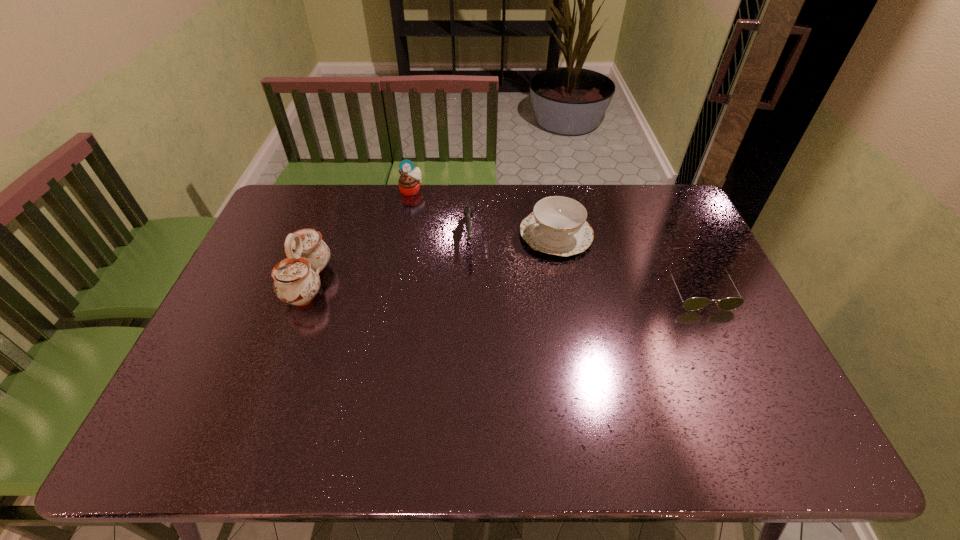
Where is `vacant area that lies between the fourth object from left to right and the third object from left to right`? Image resolution: width=960 pixels, height=540 pixels. vacant area that lies between the fourth object from left to right and the third object from left to right is located at coordinates (513, 235).

I want to click on empty space that is in between the tallest object and the shorter chinaware, so click(x=432, y=259).

Identify which object is the fourth closest to the fourth object from right to left. Please provide its 2D coordinates. Your answer should be formatted as a tuple, i.e. [(x, y)], where the tuple contains the x and y coordinates of a point satisfying the conditions above.

[(696, 303)]

Point out which object is positioned as the nearest to the taller chinaware. Please provide its 2D coordinates. Your answer should be formatted as a tuple, i.e. [(x, y)], where the tuple contains the x and y coordinates of a point satisfying the conditions above.

[(409, 182)]